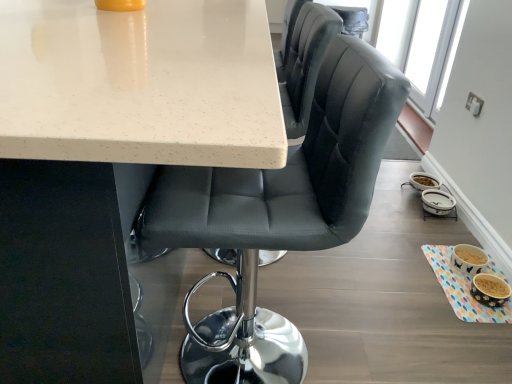
Question: Does white speckled laminate table at upper center have a lesser height compared to matte black chair at center?

Choices:
 (A) yes
 (B) no

Answer: (B)

Question: From a real-world perspective, is white speckled laminate table at upper center on matte black chair at center?

Choices:
 (A) no
 (B) yes

Answer: (A)

Question: Can you confirm if white speckled laminate table at upper center is thinner than matte black chair at center?

Choices:
 (A) yes
 (B) no

Answer: (B)

Question: Is white speckled laminate table at upper center surrounding matte black chair at center?

Choices:
 (A) no
 (B) yes

Answer: (B)

Question: Does white speckled laminate table at upper center appear on the right side of matte black chair at center?

Choices:
 (A) no
 (B) yes

Answer: (A)

Question: Is point (388, 9) positioned closer to the camera than point (248, 281)?

Choices:
 (A) closer
 (B) farther

Answer: (B)

Question: Choose the correct answer: Is transparent glass window screen at upper right inside matte black chair at center or outside it?

Choices:
 (A) inside
 (B) outside

Answer: (B)

Question: Is transparent glass window screen at upper right taller or shorter than matte black chair at center?

Choices:
 (A) short
 (B) tall

Answer: (A)

Question: Based on their sizes in the image, would you say transparent glass window screen at upper right is bigger or smaller than matte black chair at center?

Choices:
 (A) small
 (B) big

Answer: (A)

Question: From the image's perspective, is matte black chair at center positioned above or below white speckled laminate table at upper center?

Choices:
 (A) below
 (B) above

Answer: (A)

Question: Based on their positions, is matte black chair at center located to the left or right of white speckled laminate table at upper center?

Choices:
 (A) left
 (B) right

Answer: (B)

Question: Is matte black chair at center in front of or behind white speckled laminate table at upper center in the image?

Choices:
 (A) front
 (B) behind

Answer: (B)

Question: Is matte black chair at center wider or thinner than white speckled laminate table at upper center?

Choices:
 (A) thin
 (B) wide

Answer: (A)

Question: Is matte black chair at center inside the boundaries of transparent glass window screen at upper right, or outside?

Choices:
 (A) outside
 (B) inside

Answer: (A)

Question: Is matte black chair at center in front of or behind transparent glass window screen at upper right in the image?

Choices:
 (A) front
 (B) behind

Answer: (A)